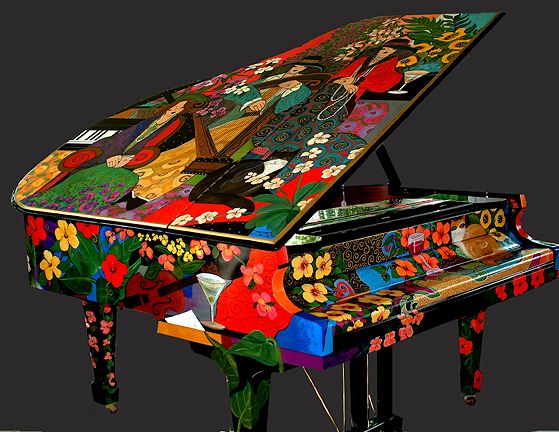
At what (x,y) coordinates should I click in order to perform the action: click on grand piano. Please return your answer as a coordinate pair (x, y). The width and height of the screenshot is (559, 432). Looking at the image, I should click on (262, 295), (482, 214).